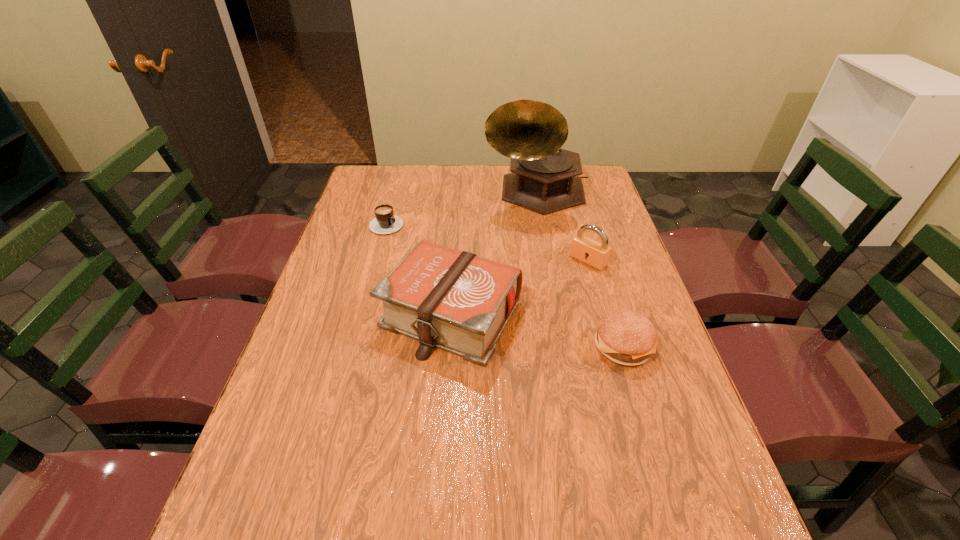
This screenshot has width=960, height=540. I want to click on free space on the desktop that is between the Bible and the hamburger and is positioned on the horn direction of the phonograph record, so click(539, 330).

This screenshot has width=960, height=540. Identify the location of free spot on the desktop that is between the Bible and the hamburger and is positioned to unlock the padlock from the front. (519, 326).

The height and width of the screenshot is (540, 960). Identify the location of free space on the desktop that is between the Bible and the hamburger and is positioned with the handle on the side of the shortest object. (546, 331).